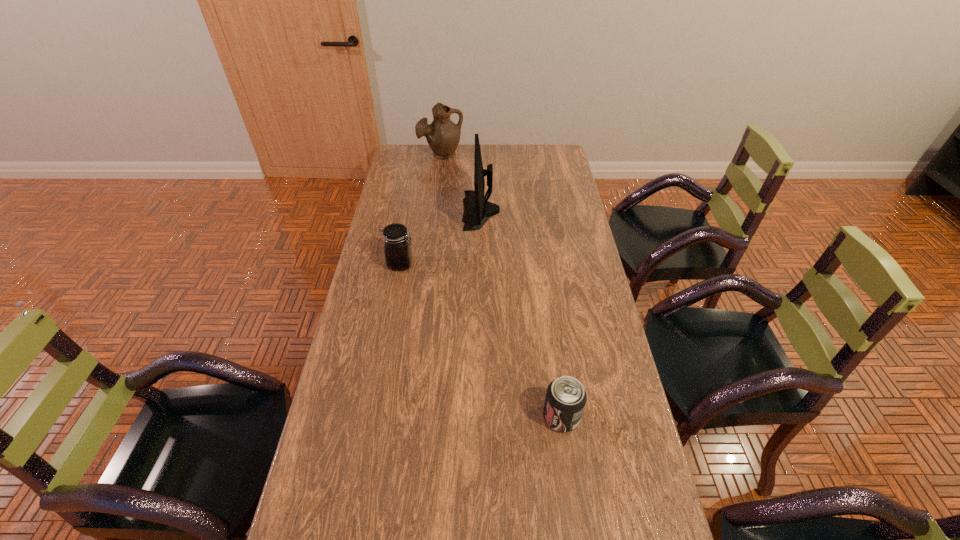
You are a GUI agent. You are given a task and a screenshot of the screen. Output one action in this format:
    pyautogui.click(x=<x>, y=<y>)
    Task: Click on the farthest object
    This screenshot has width=960, height=540.
    Given the screenshot: What is the action you would take?
    pyautogui.click(x=443, y=136)

Where is `monitor`? Image resolution: width=960 pixels, height=540 pixels. monitor is located at coordinates (477, 209).

Locate an element on the screen. The height and width of the screenshot is (540, 960). the third nearest object is located at coordinates (477, 209).

Locate an element on the screen. the third farthest object is located at coordinates (397, 246).

You are a GUI agent. You are given a task and a screenshot of the screen. Output one action in this format:
    pyautogui.click(x=<x>, y=<y>)
    Task: Click on the soda can
    Image resolution: width=960 pixels, height=540 pixels.
    Given the screenshot: What is the action you would take?
    pyautogui.click(x=565, y=400)

This screenshot has height=540, width=960. I want to click on the nearest object, so click(565, 400).

This screenshot has height=540, width=960. What are the coordinates of `vacant space located at the spout of the pitcher` in the screenshot? It's located at (437, 188).

At what (x,y) coordinates should I click in order to perform the action: click on vacant space positioned on the screen side of the second farthest object. Please return your answer as a coordinate pair (x, y). Looking at the image, I should click on (421, 210).

Where is `vacant point located 0.120m on the screen side of the second farthest object`? The image size is (960, 540). vacant point located 0.120m on the screen side of the second farthest object is located at coordinates (433, 210).

I want to click on vacant area situated 0.170m on the screen side of the second farthest object, so click(x=421, y=210).